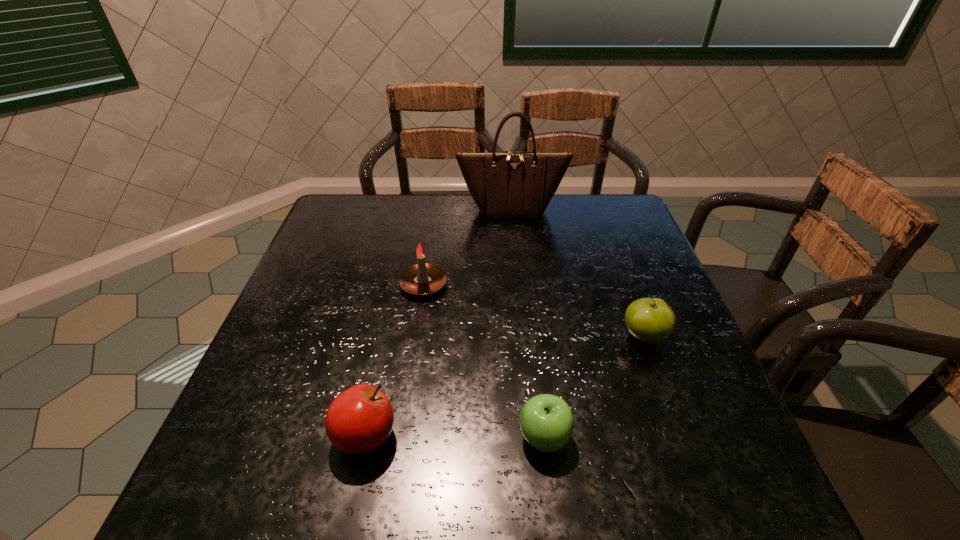
The width and height of the screenshot is (960, 540). In order to click on free point between the leftmost apple and the rightmost apple in this screenshot , I will do `click(505, 387)`.

The height and width of the screenshot is (540, 960). In order to click on free space between the tallest object and the candle in this screenshot , I will do [468, 247].

Where is `unoccupied area between the handbag and the second farthest object`? unoccupied area between the handbag and the second farthest object is located at coordinates (468, 247).

Where is `free space that is in between the rightmost object and the candle`? free space that is in between the rightmost object and the candle is located at coordinates (534, 311).

The height and width of the screenshot is (540, 960). Identify the location of vacant area between the rightmost object and the tallest object. (578, 273).

The height and width of the screenshot is (540, 960). I want to click on free space between the handbag and the fourth nearest object, so click(x=468, y=247).

I want to click on vacant space in between the tallest object and the second apple from right to left, so click(x=528, y=323).

Find the location of a particular element. Image resolution: width=960 pixels, height=540 pixels. free spot between the second farthest object and the leftmost apple is located at coordinates (x=395, y=361).

Find the location of a particular element. free space that is in between the farthest object and the fourth nearest object is located at coordinates (468, 247).

Image resolution: width=960 pixels, height=540 pixels. I want to click on free space that is in between the second apple from right to left and the tallest object, so click(528, 323).